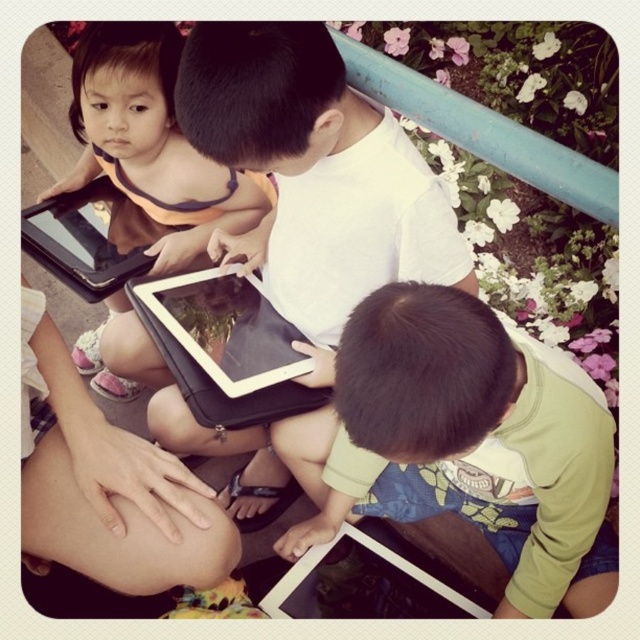
From the picture: You are a photographer trying to capture a clear shot of the green matte shirt at lower right and the white matte tablet at center. Which object should you focus on first to ensure both are in focus?

You should focus on the green matte shirt at lower right first because it is closer to the viewer than the white matte tablet at center, so adjusting focus from near to far will help both be in focus.

You are a photographer trying to capture a clear shot of the black matte tablet at upper left and the matte black tablet at lower center. Since you want both tablets to be in focus, which one should you focus on first to ensure the other is also in focus?

The black matte tablet at upper left is above the matte black tablet at lower center, so focusing on the upper tablet first would ensure the lower one is also in focus due to their vertical alignment.